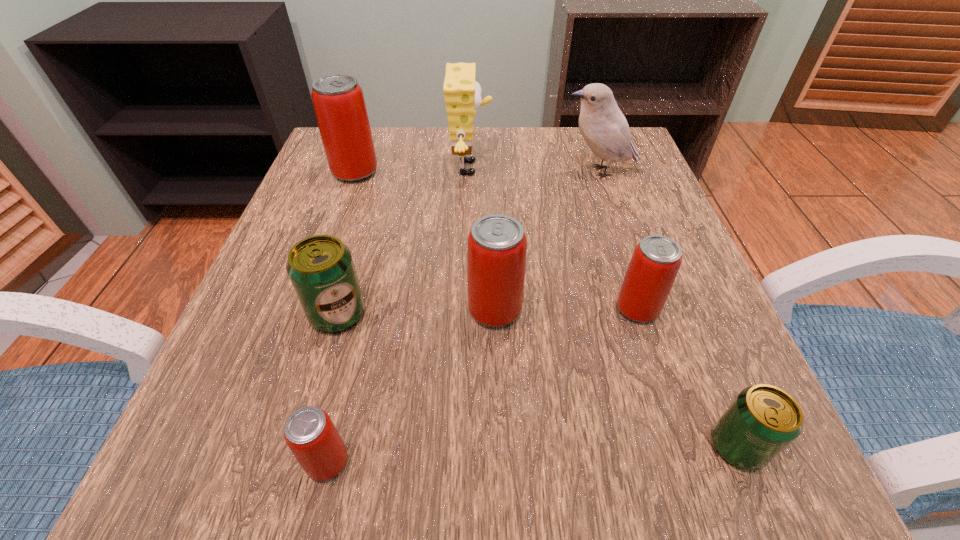
Identify the location of yellow sponge. (462, 94).

This screenshot has width=960, height=540. I want to click on the farthest beer can, so click(x=338, y=100).

Where is `the leftmost pink beer can`? the leftmost pink beer can is located at coordinates (338, 100).

Where is `white bird`? This screenshot has height=540, width=960. white bird is located at coordinates (603, 126).

Locate an element on the screen. the fifth shortest object is located at coordinates (496, 250).

Locate an element on the screen. the second biggest pink beer can is located at coordinates (496, 250).

The height and width of the screenshot is (540, 960). In order to click on the farther green beer can in this screenshot , I will do `click(321, 269)`.

Locate an element on the screen. the left green beer can is located at coordinates (321, 269).

Find the location of `the second beer can from right to left`. the second beer can from right to left is located at coordinates (656, 260).

Identify the location of the second smallest pink beer can. This screenshot has height=540, width=960. (656, 260).